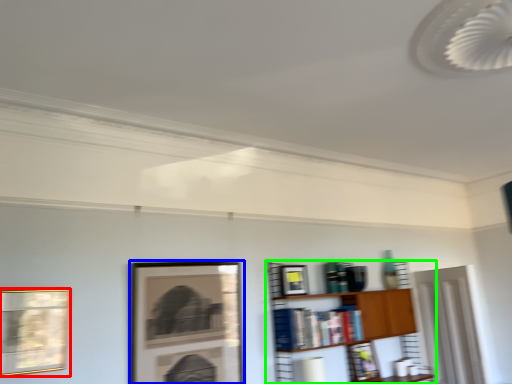
Question: Which object is positioned closest to picture frame (highlighted by a red box)? Select from picture frame (highlighted by a blue box) and shelf (highlighted by a green box).

Choices:
 (A) picture frame
 (B) shelf

Answer: (A)